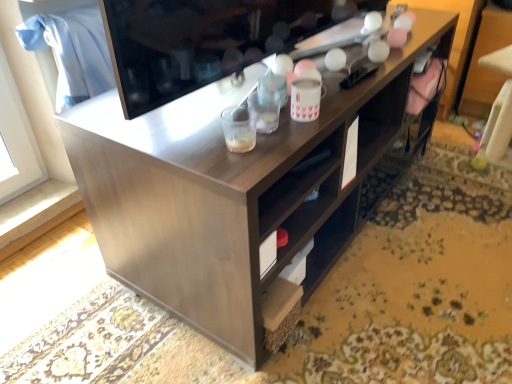
Locate an element on the screen. The width and height of the screenshot is (512, 384). vacant space to the left of white ceramic mug at upper center, which is the first beverage in right-to-left order is located at coordinates (228, 115).